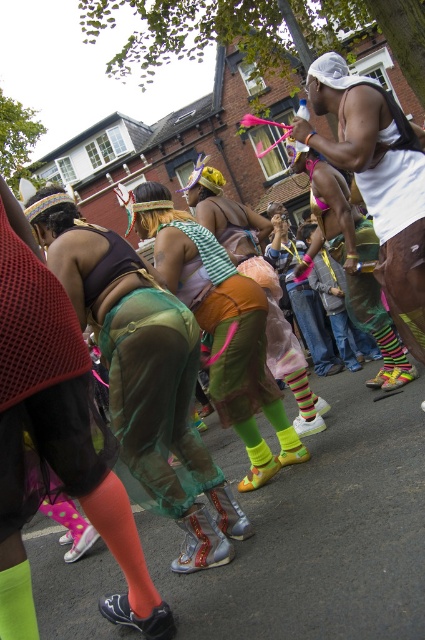
Question: Is green mesh skirt at center below green mesh dress at center?

Choices:
 (A) no
 (B) yes

Answer: (B)

Question: Is green mesh skirt at center above green mesh dress at center?

Choices:
 (A) no
 (B) yes

Answer: (A)

Question: From the image, what is the correct spatial relationship of green mesh skirt at center in relation to green mesh dress at center?

Choices:
 (A) above
 (B) below

Answer: (B)

Question: Which point is closer to the camera?

Choices:
 (A) (221, 275)
 (B) (424, 220)

Answer: (B)

Question: Which object appears closest to the camera in this image?

Choices:
 (A) green mesh skirt at center
 (B) white matte tank top at upper right

Answer: (A)

Question: Among these points, which one is farthest from the camera?

Choices:
 (A) (405, 259)
 (B) (144, 385)
 (C) (229, 301)

Answer: (C)